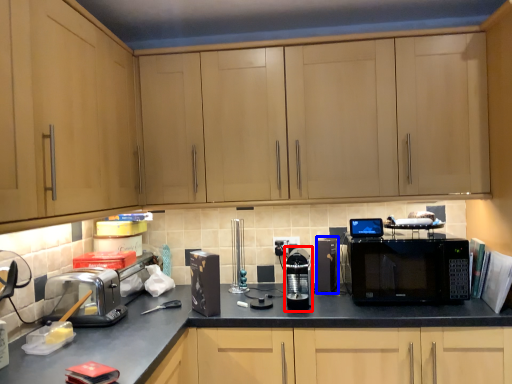
Question: Which of the following is the closest to the observer, appliance (highlighted by a red box) or appliance (highlighted by a blue box)?

Choices:
 (A) appliance
 (B) appliance

Answer: (A)